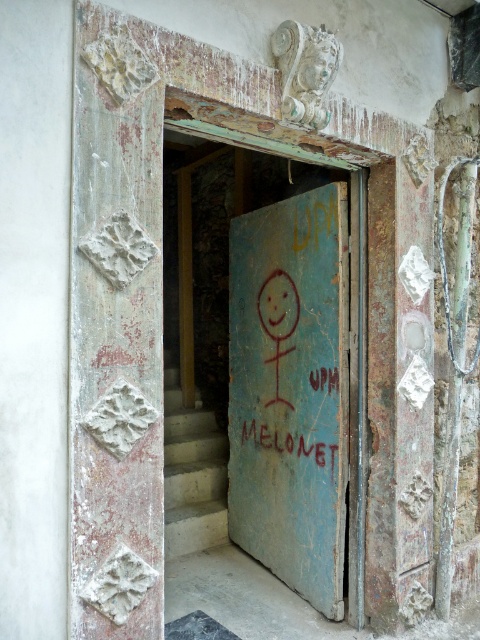
You are a delivery person with a large package that requires a 1.2 meter wide opening to pass through. You see the blue painted wood door at center and the concrete stairs at center. Which one has a wider opening for your package?

The blue painted wood door at center is wider than the concrete stairs at center, so the door has a wider opening for your package.

You are a painter who needs to cover the entire surface of the blue painted wood door at center and the red painted text at center with new paint. Which object requires more paint to cover its entire width?

The blue painted wood door at center requires more paint to cover its entire width since it is wider than the red painted text at center.

You are standing in front of the weathered doorway and want to determine the relative positions of two points marked on the door. The first point is at coordinates point (255, 518) and the second is at point (299, 436). Which point is closer to you?

Point (255, 518) is further to the viewer than point (299, 436). Wait, but the question asks which is closer. So the answer should be point (299, 436) is closer because the first point is further away. Hmm, need to clarify.